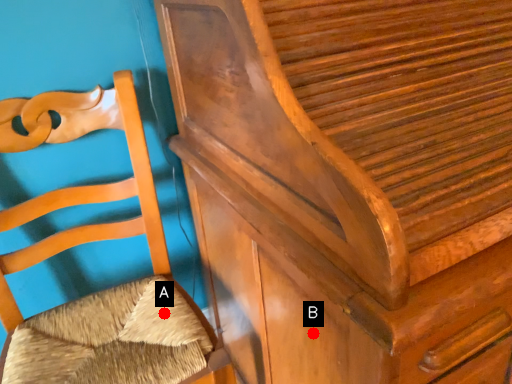
Question: Two points are circled on the image, labeled by A and B beside each circle. Among these points, which one is farthest from the camera?

Choices:
 (A) A is further
 (B) B is further

Answer: (A)